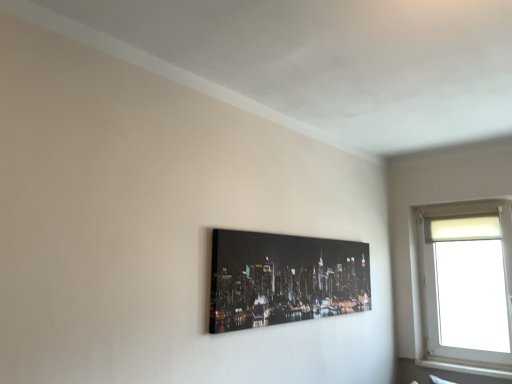
Question: Considering the relative sizes of white plastic window at upper right and black glossy canvas at center in the image provided, is white plastic window at upper right wider than black glossy canvas at center?

Choices:
 (A) yes
 (B) no

Answer: (A)

Question: Does white plastic window at upper right have a lesser height compared to black glossy canvas at center?

Choices:
 (A) yes
 (B) no

Answer: (B)

Question: Is white plastic window at upper right far away from black glossy canvas at center?

Choices:
 (A) no
 (B) yes

Answer: (B)

Question: From a real-world perspective, is white plastic window at upper right below black glossy canvas at center?

Choices:
 (A) yes
 (B) no

Answer: (A)

Question: Is white plastic window at upper right thinner than black glossy canvas at center?

Choices:
 (A) yes
 (B) no

Answer: (B)

Question: Is the position of white plastic window at upper right more distant than that of black glossy canvas at center?

Choices:
 (A) no
 (B) yes

Answer: (B)

Question: From the image's perspective, is black glossy canvas at center located above white plastic window at upper right?

Choices:
 (A) no
 (B) yes

Answer: (B)

Question: Is black glossy canvas at center positioned behind white plastic window at upper right?

Choices:
 (A) no
 (B) yes

Answer: (A)

Question: Can you confirm if black glossy canvas at center is taller than white plastic window at upper right?

Choices:
 (A) yes
 (B) no

Answer: (B)

Question: Is black glossy canvas at center in front of white plastic window at upper right?

Choices:
 (A) yes
 (B) no

Answer: (A)

Question: From a real-world perspective, does black glossy canvas at center sit lower than white plastic window at upper right?

Choices:
 (A) yes
 (B) no

Answer: (B)

Question: Does black glossy canvas at center contain white plastic window at upper right?

Choices:
 (A) yes
 (B) no

Answer: (B)

Question: Considering the positions of point (353, 248) and point (463, 258), is point (353, 248) closer or farther from the camera than point (463, 258)?

Choices:
 (A) farther
 (B) closer

Answer: (B)